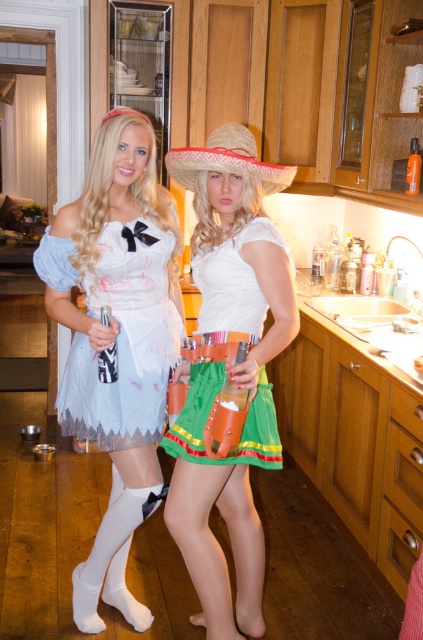
Question: Which point appears farthest from the camera in this image?

Choices:
 (A) (225, 259)
 (B) (145, 225)
 (C) (241, 148)

Answer: (B)

Question: Does green fabric skirt at center have a lesser width compared to light blue satin dress at center?

Choices:
 (A) no
 (B) yes

Answer: (B)

Question: Which object is the farthest from the green fabric skirt at center?

Choices:
 (A) green satin dress at center
 (B) white tulle dress at left
 (C) light blue satin dress at center
 (D) straw hat at center

Answer: (D)

Question: Estimate the real-world distances between objects in this image. Which object is closer to the green satin dress at center?

Choices:
 (A) green fabric skirt at center
 (B) white tulle dress at left
 (C) light blue satin dress at center

Answer: (A)

Question: Does light blue satin dress at center appear over green satin dress at center?

Choices:
 (A) yes
 (B) no

Answer: (A)

Question: Does white tulle dress at left have a greater width compared to light blue satin dress at center?

Choices:
 (A) no
 (B) yes

Answer: (A)